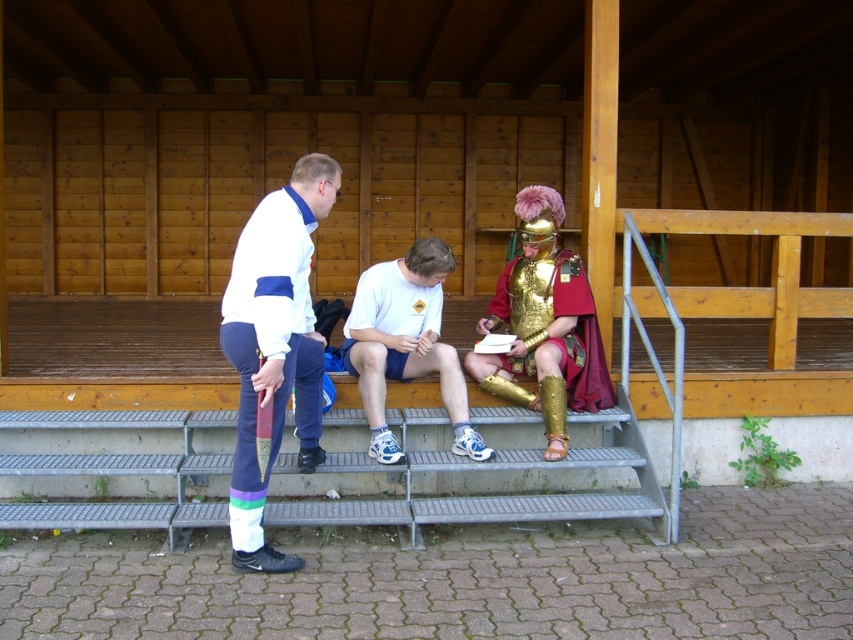
You are a painter wanting to capture the scene. You need to decide which object to focus on first based on their heights. Which object should you focus on first, the metallic gray stairs at lower center or the gold plated armor at center?

The gold plated armor at center is taller than the metallic gray stairs at lower center, so you should focus on the gold plated armor at center first.

You are standing at the bottom of the metallic gray stairs at lower center and want to reach the white fabric jacket at center. Which direction should you move to get closer to the jacket?

To reach the white fabric jacket at center from the bottom of the metallic gray stairs at lower center, you should move upward since the metallic gray stairs at lower center are positioned under the white fabric jacket at center.